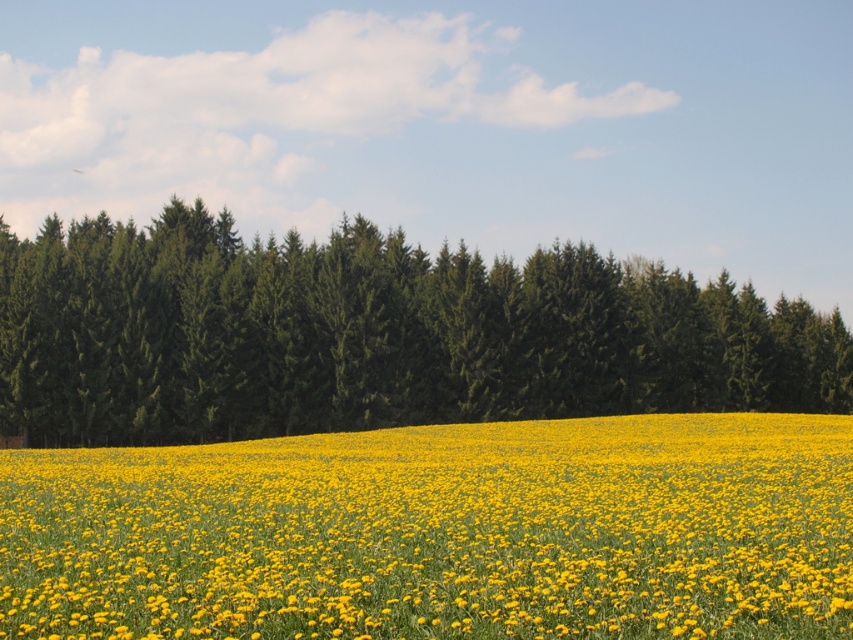
Can you confirm if yellow matte flower at center is positioned to the right of green matte trees at center?

Incorrect, yellow matte flower at center is not on the right side of green matte trees at center.

Does point (669, 522) lie in front of point (302, 353)?

Yes, point (669, 522) is in front of point (302, 353).

Describe the element at coordinates (440, 532) in the screenshot. I see `yellow matte flower at center` at that location.

Find the location of a particular element. The height and width of the screenshot is (640, 853). yellow matte flower at center is located at coordinates (440, 532).